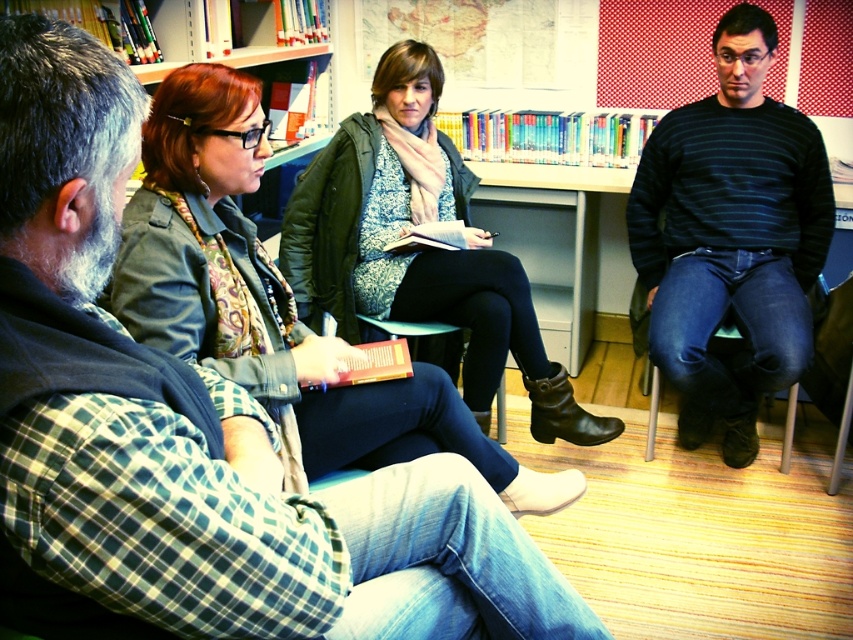
Question: Among these objects, which one is nearest to the camera?

Choices:
 (A) dark blue striped sweater at right
 (B) dark blue fabric chair at right
 (C) matte green jacket at upper left

Answer: (C)

Question: Based on their relative distances, which object is nearer to the dark blue fabric chair at right?

Choices:
 (A) matte green jacket at upper left
 (B) matte black jacket at center
 (C) dark blue striped sweater at right

Answer: (C)

Question: From the image, what is the correct spatial relationship of dark blue striped sweater at right in relation to dark blue fabric chair at right?

Choices:
 (A) left
 (B) right

Answer: (B)

Question: Can you confirm if dark blue striped sweater at right is thinner than dark blue fabric chair at right?

Choices:
 (A) yes
 (B) no

Answer: (B)

Question: Which of these objects is positioned closest to the matte green jacket at upper left?

Choices:
 (A) dark blue fabric chair at right
 (B) dark blue striped sweater at right
 (C) matte black jacket at center

Answer: (C)

Question: Does matte green jacket at upper left lie behind matte black jacket at center?

Choices:
 (A) yes
 (B) no

Answer: (B)